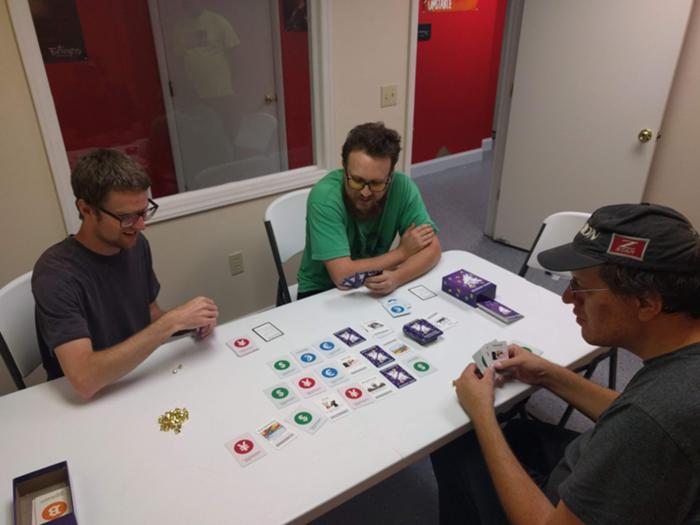
The height and width of the screenshot is (525, 700). I want to click on chair, so click(x=21, y=317), click(x=293, y=220), click(x=563, y=225).